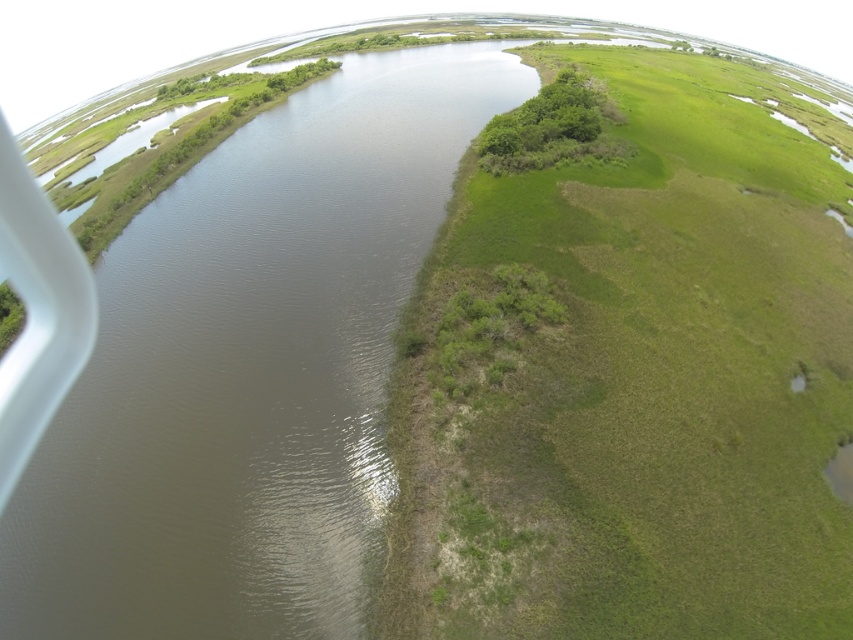
You are a pilot flying a small plane and notice two objects from above. You see the brown muddy water at center and the white plastic airplane window at left. Which object is positioned more to the east?

The brown muddy water at center is to the right of the white plastic airplane window at left, so the brown muddy water at center is positioned more to the east.